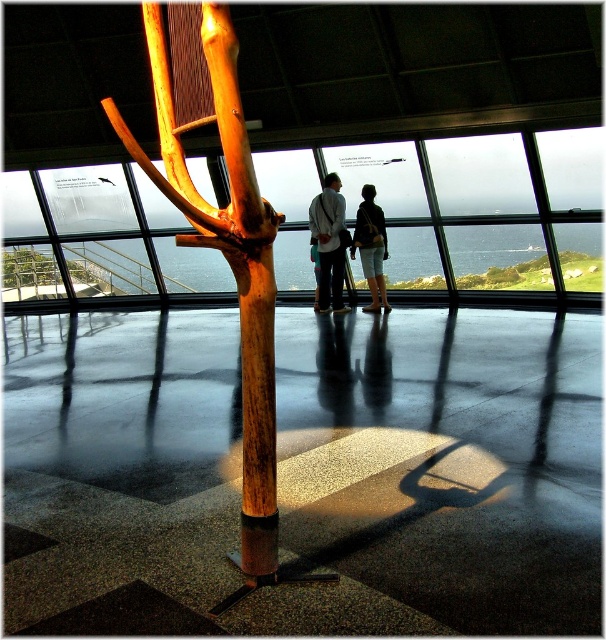
Question: Which object is farther from the camera taking this photo?

Choices:
 (A) natural wood pole at center
 (B) wooden sculpture at center

Answer: (A)

Question: Is transparent glass window at center positioned at the back of white cotton shirt at center?

Choices:
 (A) yes
 (B) no

Answer: (B)

Question: Considering the relative positions of wooden sculpture at center and natural wood pole at center in the image provided, where is wooden sculpture at center located with respect to natural wood pole at center?

Choices:
 (A) left
 (B) right

Answer: (A)

Question: Estimate the real-world distances between objects in this image. Which object is farther from the wooden sculpture at center?

Choices:
 (A) white cotton shirt at center
 (B) denim shorts at center

Answer: (B)

Question: Observing the image, what is the correct spatial positioning of transparent glass window at center in reference to white cotton shirt at center?

Choices:
 (A) right
 (B) left

Answer: (B)

Question: Which is nearer to the denim shorts at center?

Choices:
 (A) white cotton shirt at center
 (B) transparent glass window at center
 (C) wooden sculpture at center

Answer: (A)